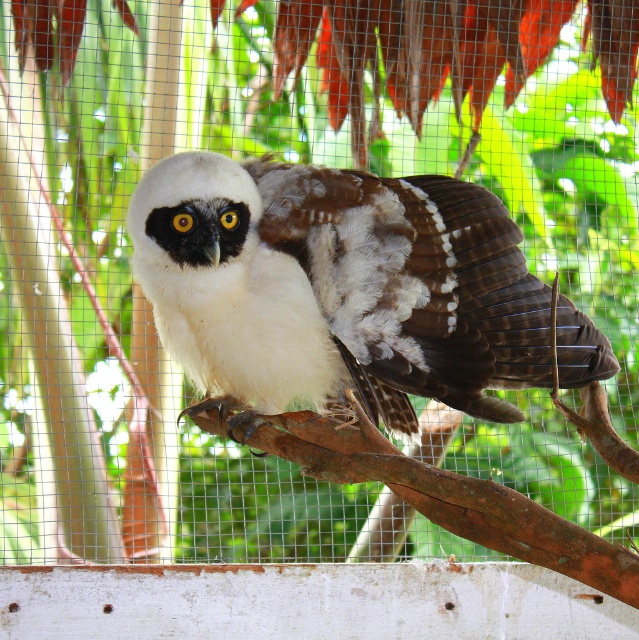
Consider the image. Is white soft feathers at center below brown rough tree branch at center?

Actually, white soft feathers at center is above brown rough tree branch at center.

Between white soft feathers at center and brown rough tree branch at center, which one appears on the right side from the viewer's perspective?

From the viewer's perspective, brown rough tree branch at center appears more on the right side.

Who is more distant from viewer, (x=289, y=280) or (x=475, y=540)?

The point (x=289, y=280) is more distant.

Where is `white soft feathers at center`? The image size is (639, 640). white soft feathers at center is located at coordinates (335, 288).